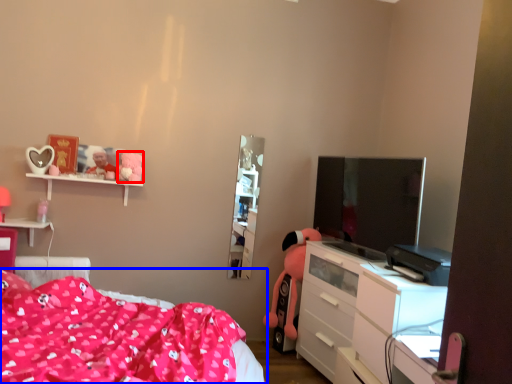
Question: Which object appears closest to the camera in this image, toy (highlighted by a red box) or bed (highlighted by a blue box)?

Choices:
 (A) toy
 (B) bed

Answer: (B)